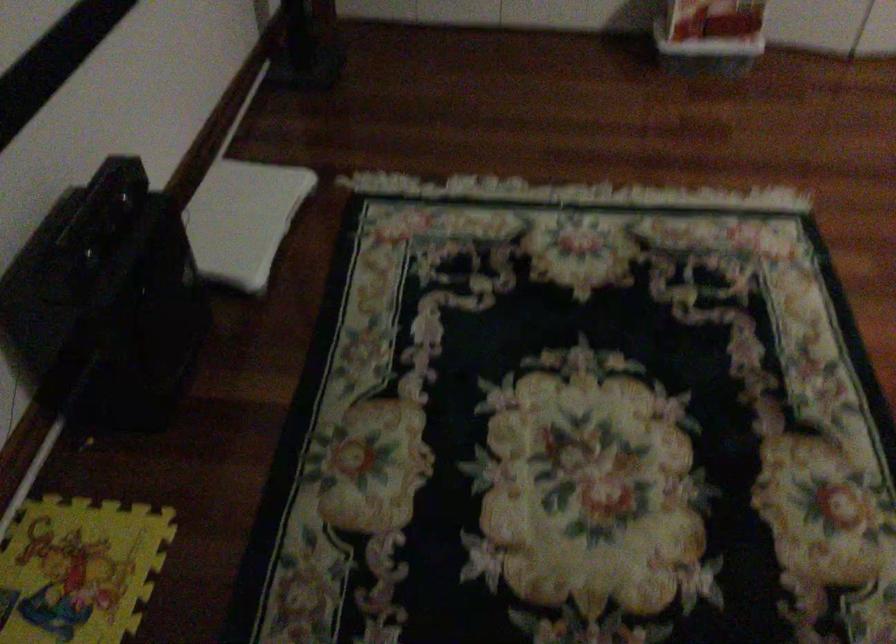
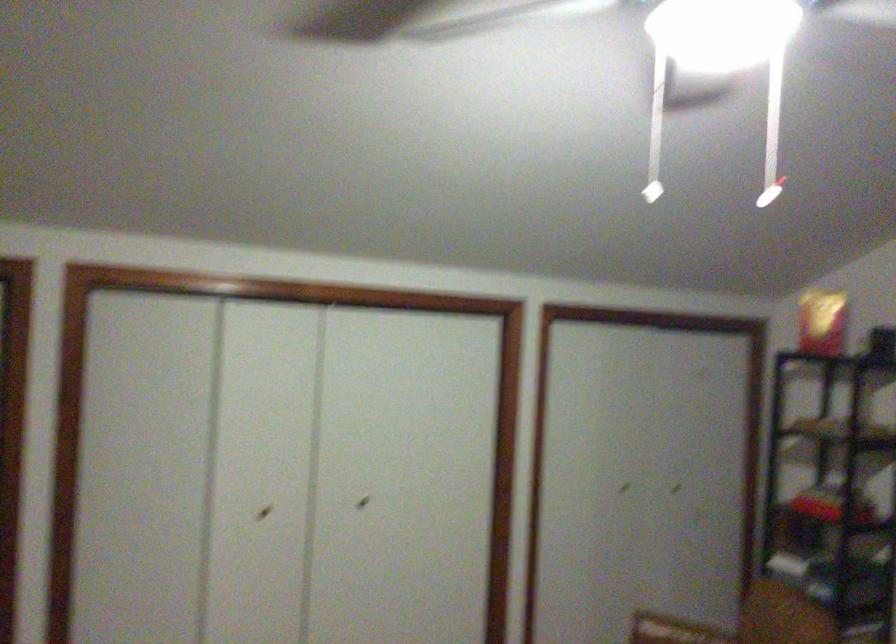
How did the camera likely rotate?

The camera's rotation is toward right-up.